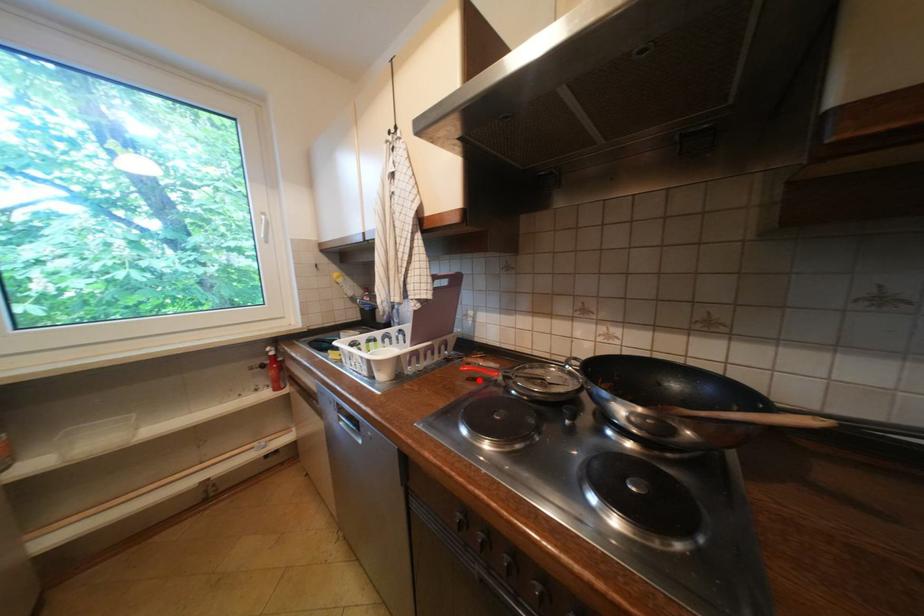
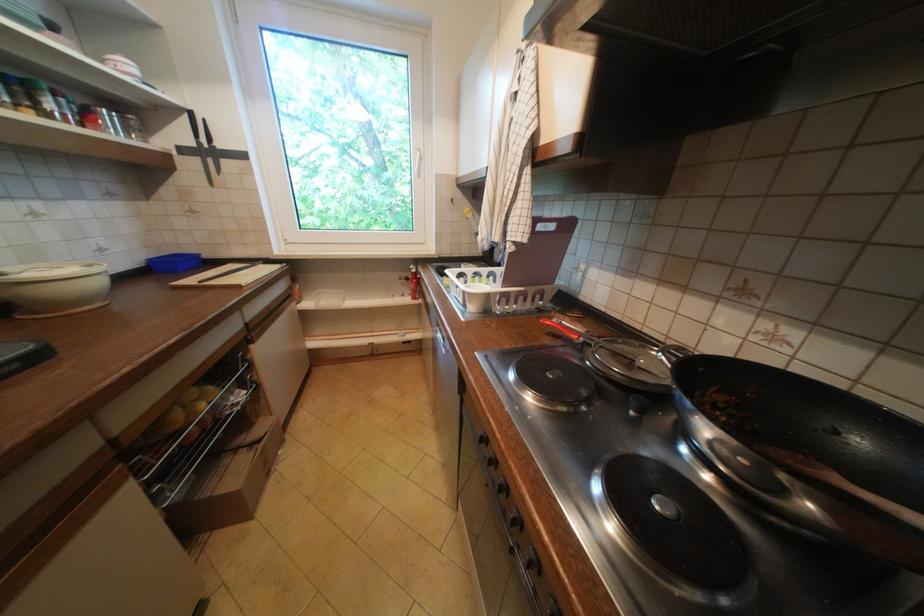
Where in the second image is the point corresponding to the highlighted location from the first image?

(558, 334)